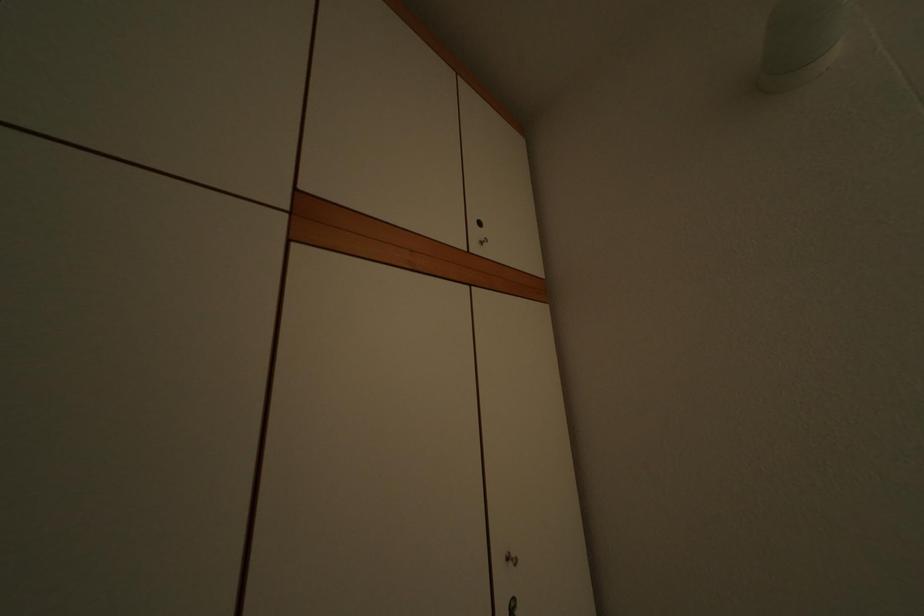
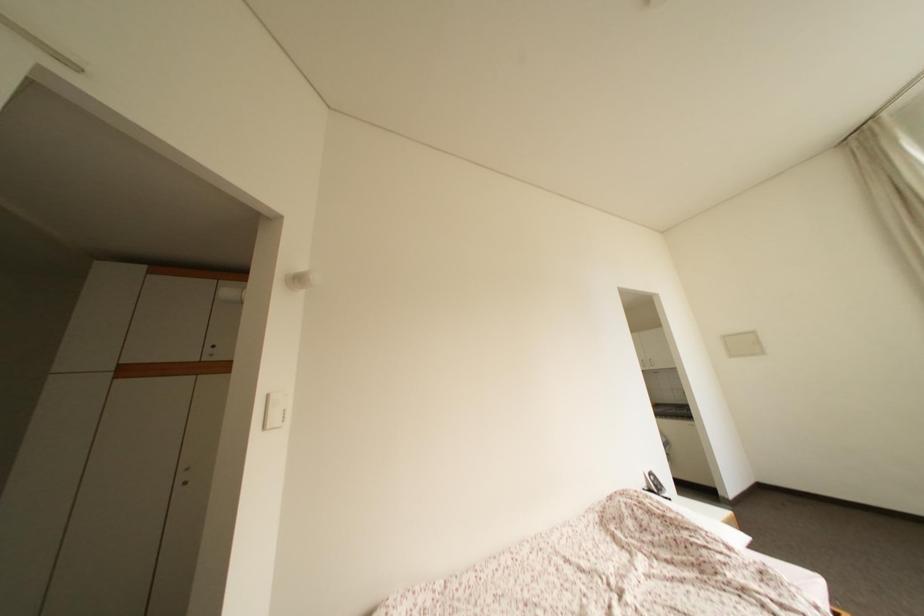
Question: What movement of the cameraman would produce the second image?

Choices:
 (A) Left
 (B) Right
 (C) Forward
 (D) Backward

Answer: (B)